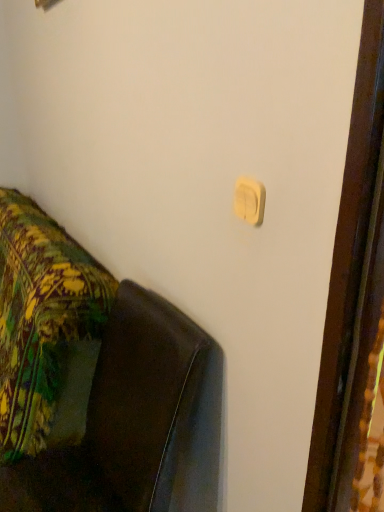
Question: Is leather couch at lower left wider or thinner than white matte light switch at upper center?

Choices:
 (A) wide
 (B) thin

Answer: (A)

Question: In the image, is leather couch at lower left on the left side or the right side of white matte light switch at upper center?

Choices:
 (A) left
 (B) right

Answer: (A)

Question: From the image's perspective, relative to white matte light switch at upper center, is leather couch at lower left above or below?

Choices:
 (A) below
 (B) above

Answer: (A)

Question: Looking at their shapes, would you say white matte light switch at upper center is wider or thinner than leather couch at lower left?

Choices:
 (A) thin
 (B) wide

Answer: (A)

Question: Visually, is white matte light switch at upper center positioned to the left or to the right of leather couch at lower left?

Choices:
 (A) right
 (B) left

Answer: (A)

Question: Is white matte light switch at upper center bigger or smaller than leather couch at lower left?

Choices:
 (A) big
 (B) small

Answer: (B)

Question: From a real-world perspective, relative to leather couch at lower left, is white matte light switch at upper center vertically above or below?

Choices:
 (A) below
 (B) above

Answer: (B)